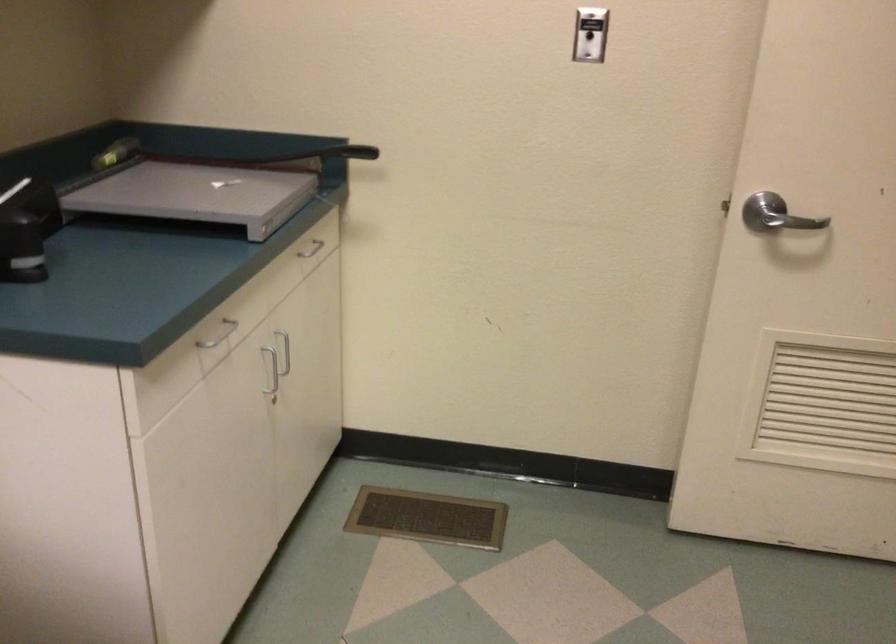
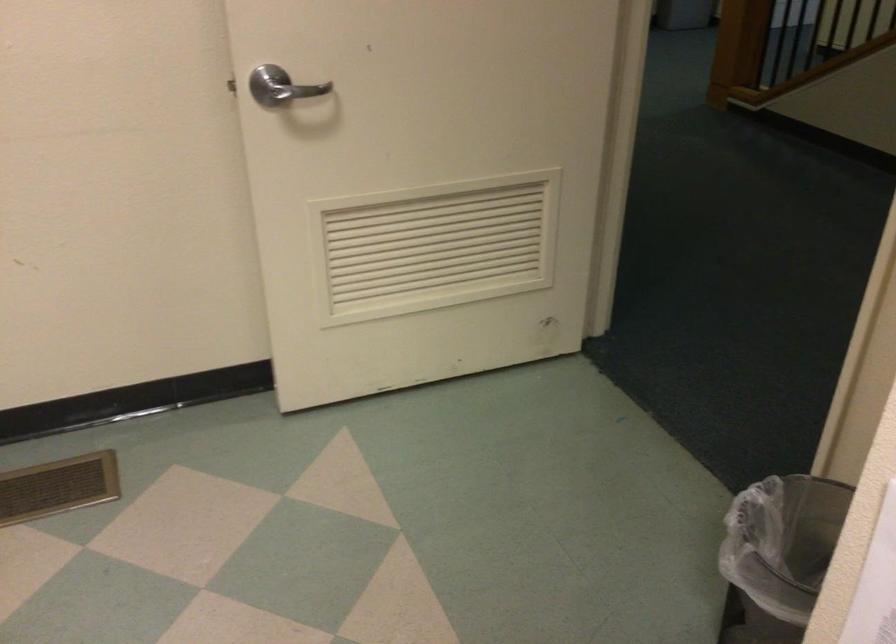
Where in the second image is the point corresponding to [454,524] from the first image?

(57, 487)